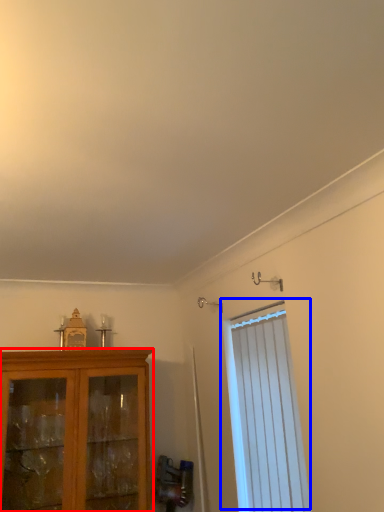
Question: Which object is closer to the camera taking this photo, cabinetry (highlighted by a red box) or window (highlighted by a blue box)?

Choices:
 (A) cabinetry
 (B) window

Answer: (B)